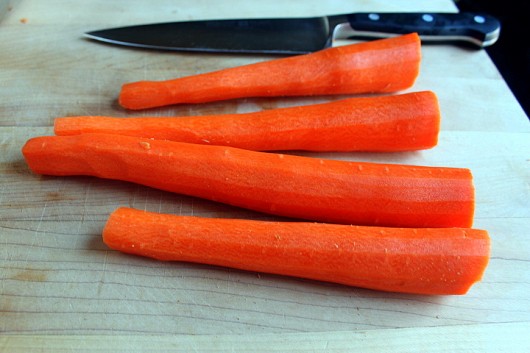
Locate an element on the screen. Image resolution: width=530 pixels, height=353 pixels. board is located at coordinates (282, 323).